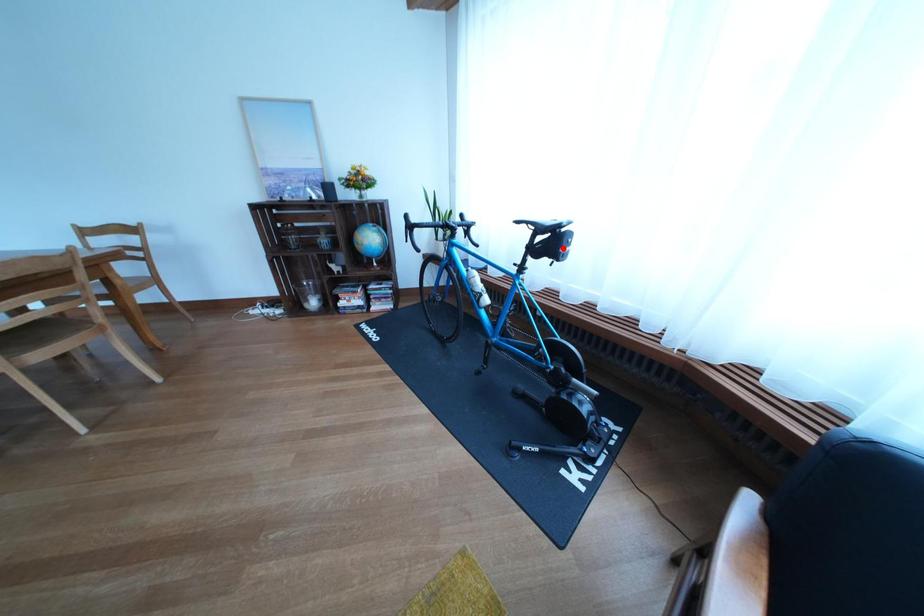
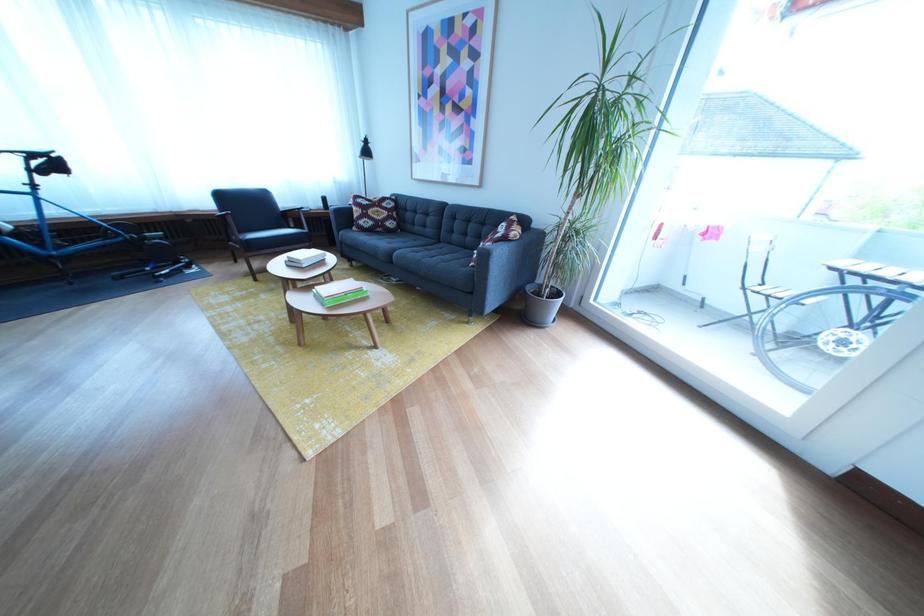
Question: A red point is marked in image1. In image2, is the corresponding 3D point closer to the camera or farther? Reply with the corresponding letter.

Choices:
 (A) The corresponding 3D point is closer.
 (B) The corresponding 3D point is farther.

Answer: (B)